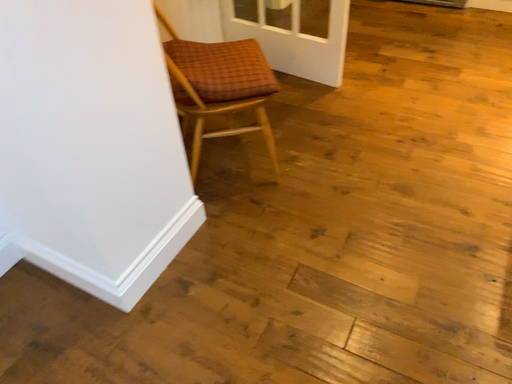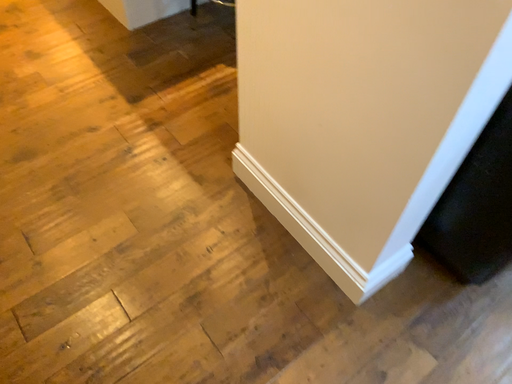
Question: How did the camera likely rotate when shooting the video?

Choices:
 (A) rotated upward
 (B) rotated downward

Answer: (A)